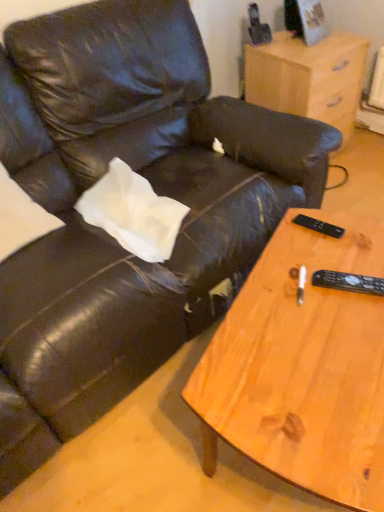
Find the location of `unoccupied area in front of black plastic remote at right, arranged as the 2th remote when viewed from the top`. unoccupied area in front of black plastic remote at right, arranged as the 2th remote when viewed from the top is located at coordinates (354, 340).